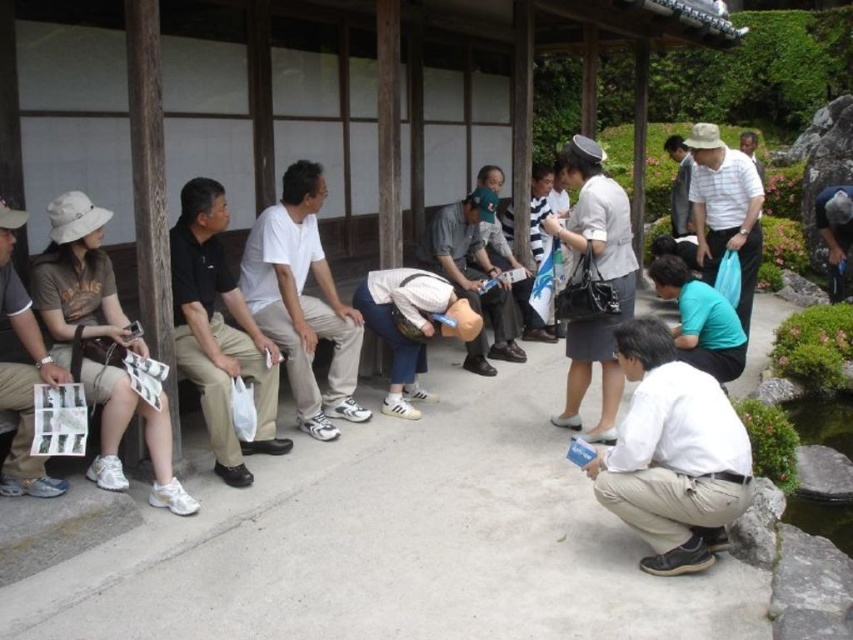
Which of these two, white matte shirt at center or white matte cap at center, stands taller?

With more height is white matte shirt at center.

Can you confirm if white matte shirt at center is shorter than white matte cap at center?

No.

Find the location of a particular element. Image resolution: width=853 pixels, height=640 pixels. white matte shirt at center is located at coordinates (302, 301).

Is point (676, 493) positioned in front of point (287, 273)?

Yes, it is.

At what (x,y) coordinates should I click in order to perform the action: click on white matte shirt at lower right. Please return your answer as a coordinate pair (x, y). The image size is (853, 640). Looking at the image, I should click on (672, 454).

Does black cotton shirt at center have a greater height compared to gray fabric skirt at center?

No.

What do you see at coordinates (219, 332) in the screenshot?
I see `black cotton shirt at center` at bounding box center [219, 332].

Measure the distance between point (235, 353) and camera.

The distance of point (235, 353) from camera is 4.13 meters.

Locate an element on the screen. Image resolution: width=853 pixels, height=640 pixels. black cotton shirt at center is located at coordinates (219, 332).